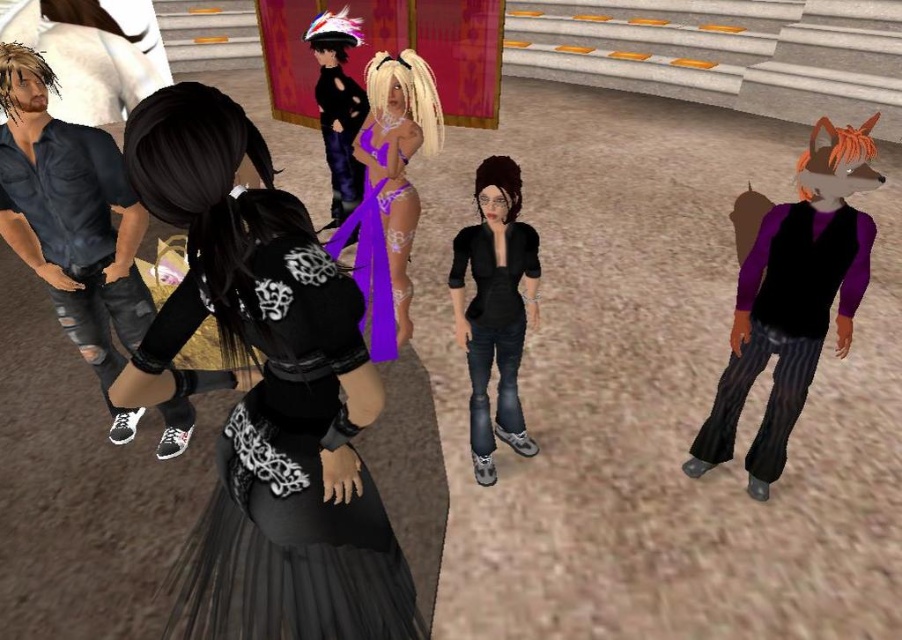
Question: Which object is farther from the camera taking this photo?

Choices:
 (A) shiny black dress at center
 (B) black satin dress at center
 (C) matte purple vest at center
 (D) lace purple dress at center

Answer: (A)

Question: Can you confirm if black satin dress at center is positioned to the left of matte black shirt at center?

Choices:
 (A) yes
 (B) no

Answer: (A)

Question: Can you confirm if matte black shirt at center is bigger than shiny black dress at center?

Choices:
 (A) yes
 (B) no

Answer: (B)

Question: Which point is closer to the camera?

Choices:
 (A) shiny black dress at center
 (B) matte black shirt at center
 (C) lace purple dress at center

Answer: (C)

Question: Among these objects, which one is farthest from the camera?

Choices:
 (A) matte black shirt at center
 (B) black satin dress at center
 (C) lace purple dress at center
 (D) purple satin dress at center

Answer: (D)

Question: Can you confirm if matte purple vest at center is smaller than matte black shirt at center?

Choices:
 (A) no
 (B) yes

Answer: (A)